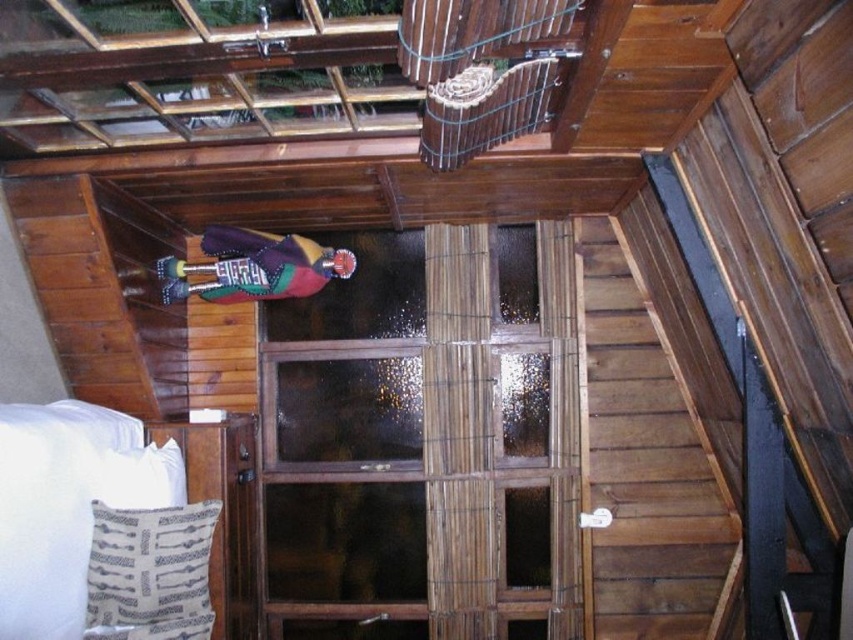
You are designing a room layout and need to place a tall lamp next to the white soft bed at lower left and the patterned fabric pillow at lower left. Which object should the lamp be placed next to to ensure it can accommodate the lamp height?

The lamp should be placed next to the white soft bed at lower left because it has a greater height compared to the patterned fabric pillow at lower left, providing enough space for the lamp.

You are standing in the room and want to place a new painting on the wall behind the wooden birdcage at upper center. Is the patterned fabric pillow at lower left blocking the area where you want to hang the painting?

The wooden birdcage at upper center is in front of the patterned fabric pillow at lower left, so the pillow is behind the birdcage. Therefore, the patterned fabric pillow at lower left is not blocking the area behind the wooden birdcage at upper center. You can safely hang the painting there.